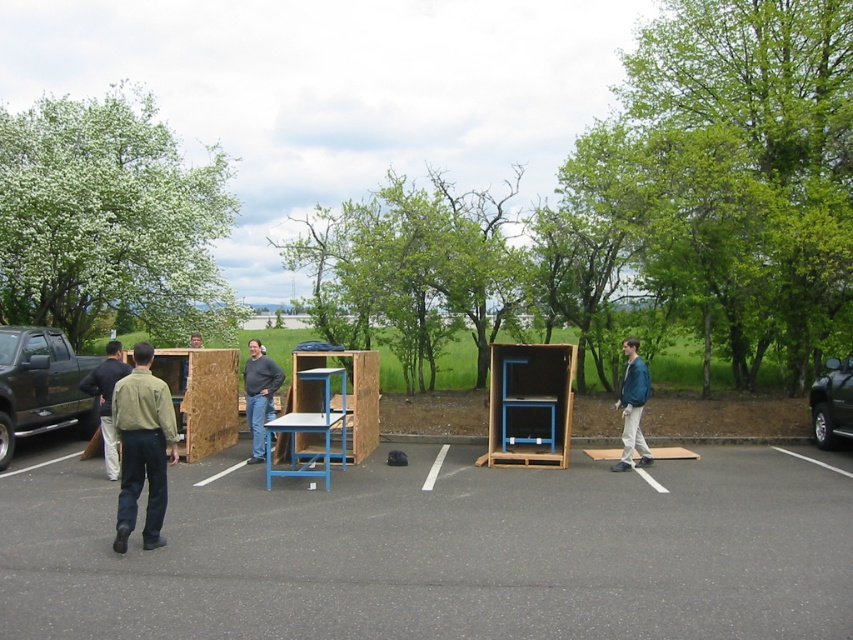
From the picture: Who is positioned more to the right, black matte truck at left or green matte shirt at left?

Positioned to the right is green matte shirt at left.

Does black matte truck at left appear on the left side of green matte shirt at left?

Yes, black matte truck at left is to the left of green matte shirt at left.

Identify the location of black matte truck at left. (39, 385).

The image size is (853, 640). I want to click on black matte truck at left, so click(x=39, y=385).

Does green matte shirt at left appear under dark blue shirt at left?

No, green matte shirt at left is not below dark blue shirt at left.

Is green matte shirt at left further to the viewer compared to dark blue shirt at left?

No, it is in front of dark blue shirt at left.

At what (x,y) coordinates should I click in order to perform the action: click on green matte shirt at left. Please return your answer as a coordinate pair (x, y). The height and width of the screenshot is (640, 853). Looking at the image, I should click on (142, 448).

Can you confirm if black matte truck at left is bigger than dark blue shirt at left?

Yes, black matte truck at left is bigger than dark blue shirt at left.

Does black matte truck at left have a greater width compared to dark blue shirt at left?

Correct, the width of black matte truck at left exceeds that of dark blue shirt at left.

Who is more forward, (86, 429) or (102, 422)?

Point (102, 422) is more forward.

At what (x,y) coordinates should I click in order to perform the action: click on black matte truck at left. Please return your answer as a coordinate pair (x, y). This screenshot has width=853, height=640. Looking at the image, I should click on (39, 385).